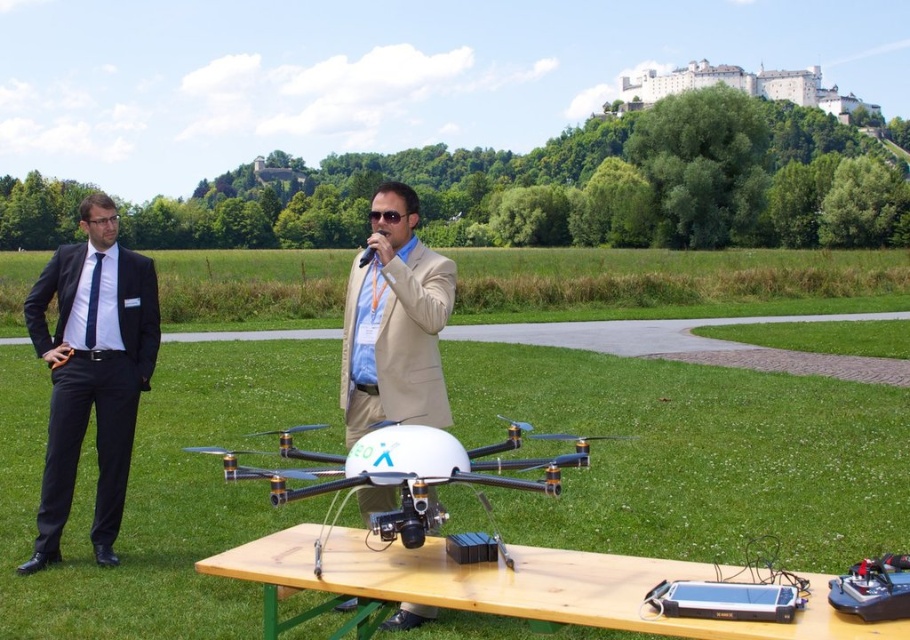
Is wooden table at center behind white matte drone at center?

No, wooden table at center is closer to the viewer.

Is point (423, 577) positioned in front of point (426, 522)?

Yes, it is in front of point (426, 522).

Locate an element on the screen. wooden table at center is located at coordinates (508, 586).

From the picture: Can you confirm if beige fabric suit at center is bigger than white matte drone at center?

Correct, beige fabric suit at center is larger in size than white matte drone at center.

Is beige fabric suit at center shorter than white matte drone at center?

No.

Which is in front, point (413, 316) or point (492, 560)?

Point (492, 560)

Where is `beige fabric suit at center`? The image size is (910, 640). beige fabric suit at center is located at coordinates (393, 323).

Which is behind, point (123, 480) or point (351, 440)?

Positioned behind is point (351, 440).

Does black suit at left have a lesser width compared to beige fabric suit at center?

No, black suit at left is not thinner than beige fabric suit at center.

This screenshot has width=910, height=640. Describe the element at coordinates (91, 374) in the screenshot. I see `black suit at left` at that location.

You are a GUI agent. You are given a task and a screenshot of the screen. Output one action in this format:
    pyautogui.click(x=<x>, y=<y>)
    Task: Click on the black suit at left
    This screenshot has width=910, height=640.
    Given the screenshot: What is the action you would take?
    pyautogui.click(x=91, y=374)